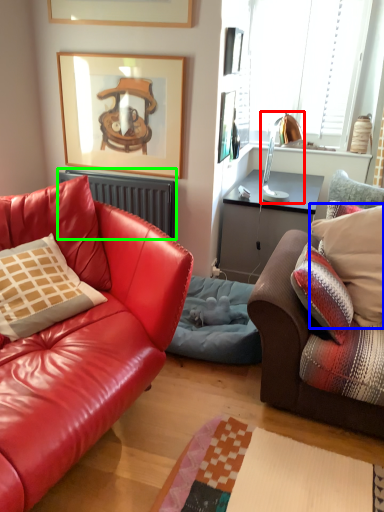
Question: Which object is the closest to the lamp (highlighted by a red box)? Choose among these: pillow (highlighted by a blue box) or radiator (highlighted by a green box).

Choices:
 (A) pillow
 (B) radiator

Answer: (B)